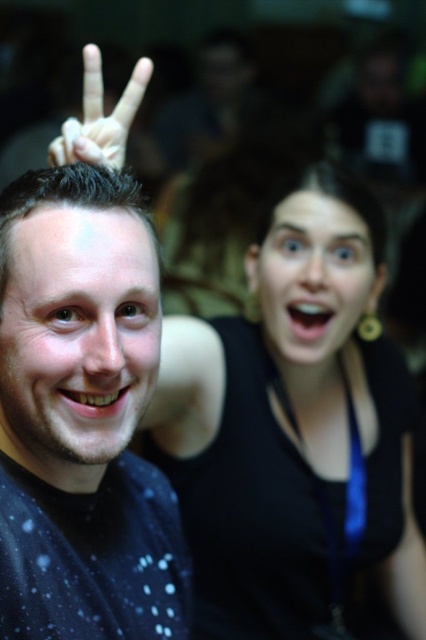
Looking at this image, you are a photographer at a party and want to take a closeup of both the smooth skin face at center and the matte black face at center. Which face should you focus on first to ensure it is in sharp focus?

The smooth skin face at center is closer to the viewer than the matte black face at center, so you should focus on the smooth skin face at center first to ensure it is in sharp focus.

You are a photographer standing 1.5 meters away from the black matte tank top at center. Can you take a clear photo of it without moving closer?

The black matte tank top at center is 1.06 meters away from the viewer. Since you are standing 1.5 meters away, you are too far to take a clear photo without moving closer.